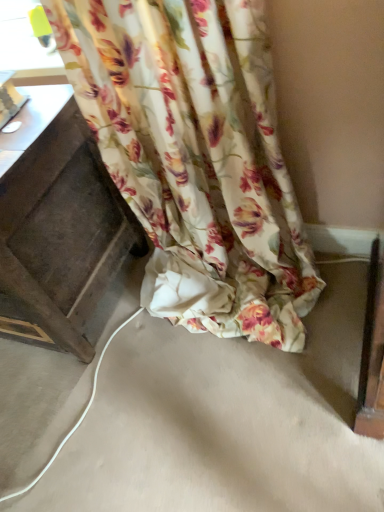
Find the location of a particular element. transparent plastic window at upper left is located at coordinates (26, 47).

The width and height of the screenshot is (384, 512). I want to click on transparent plastic window at upper left, so click(26, 47).

Does transparent plastic window at upper left appear on the left side of floral fabric curtain at lower center?

Correct, you'll find transparent plastic window at upper left to the left of floral fabric curtain at lower center.

From the image's perspective, between transparent plastic window at upper left and floral fabric curtain at lower center, who is located below?

From the image's view, floral fabric curtain at lower center is below.

Is transparent plastic window at upper left directly adjacent to floral fabric curtain at lower center?

transparent plastic window at upper left is not next to floral fabric curtain at lower center, and they're not touching.

Can you see transparent plastic window at upper left touching dark wood drawer at left?

No, transparent plastic window at upper left is not in contact with dark wood drawer at left.

Can you tell me how much transparent plastic window at upper left and dark wood drawer at left differ in facing direction?

The facing directions of transparent plastic window at upper left and dark wood drawer at left are 15.3 degrees apart.

From a real-world perspective, between transparent plastic window at upper left and dark wood drawer at left, who is vertically lower?

In real-world perspective, dark wood drawer at left is lower.

Considering the sizes of objects transparent plastic window at upper left and dark wood drawer at left in the image provided, who is smaller, transparent plastic window at upper left or dark wood drawer at left?

transparent plastic window at upper left.

Could you tell me if floral fabric curtain at lower center is turned towards transparent plastic window at upper left?

No, floral fabric curtain at lower center is not aimed at transparent plastic window at upper left.

Could you measure the distance between floral fabric curtain at lower center and transparent plastic window at upper left?

floral fabric curtain at lower center and transparent plastic window at upper left are 21.53 inches apart.

Between point (145, 187) and point (39, 61), which one is positioned behind?

Positioned behind is point (39, 61).

From a real-world perspective, is floral fabric curtain at lower center above or below transparent plastic window at upper left?

From a real-world perspective, floral fabric curtain at lower center is physically below transparent plastic window at upper left.

Which is nearer, (56, 301) or (163, 206)?

The point (56, 301) is closer.

Considering the relative sizes of dark wood drawer at left and floral fabric curtain at lower center in the image provided, is dark wood drawer at left smaller than floral fabric curtain at lower center?

No, dark wood drawer at left is not smaller than floral fabric curtain at lower center.

Considering the positions of objects dark wood drawer at left and floral fabric curtain at lower center in the image provided, who is more to the left, dark wood drawer at left or floral fabric curtain at lower center?

Positioned to the left is dark wood drawer at left.

Looking at this image, considering the sizes of objects floral fabric curtain at lower center and dark wood drawer at left in the image provided, who is wider, floral fabric curtain at lower center or dark wood drawer at left?

dark wood drawer at left is wider.

Is the surface of floral fabric curtain at lower center in direct contact with dark wood drawer at left?

No, floral fabric curtain at lower center is not making contact with dark wood drawer at left.

In the scene shown: Who is shorter, floral fabric curtain at lower center or dark wood drawer at left?

dark wood drawer at left.

Which object is closer to the camera, dark wood drawer at left or transparent plastic window at upper left?

dark wood drawer at left is in front.

From the image's perspective, is dark wood drawer at left above or below transparent plastic window at upper left?

From the image's perspective, dark wood drawer at left appears below transparent plastic window at upper left.

From a real-world perspective, does dark wood drawer at left stand above transparent plastic window at upper left?

No, from a real-world perspective, dark wood drawer at left is not above transparent plastic window at upper left.

In the image, there is a transparent plastic window at upper left. Where is `curtain below it (from a real-world perspective)`? curtain below it (from a real-world perspective) is located at coordinates (196, 158).

Identify the location of furniture located in front of the transparent plastic window at upper left. The width and height of the screenshot is (384, 512). (61, 230).

Considering their positions, is dark wood drawer at left positioned further to floral fabric curtain at lower center than transparent plastic window at upper left?

Among the two, transparent plastic window at upper left is located further to floral fabric curtain at lower center.

Considering their positions, is floral fabric curtain at lower center positioned closer to transparent plastic window at upper left than dark wood drawer at left?

Based on the image, dark wood drawer at left appears to be nearer to transparent plastic window at upper left.

Considering their positions, is floral fabric curtain at lower center positioned closer to dark wood drawer at left than transparent plastic window at upper left?

Answer: Among the two, floral fabric curtain at lower center is located nearer to dark wood drawer at left.

Considering their positions, is transparent plastic window at upper left positioned further to dark wood drawer at left than floral fabric curtain at lower center?

transparent plastic window at upper left is further to dark wood drawer at left.

Considering their positions, is dark wood drawer at left positioned closer to transparent plastic window at upper left than floral fabric curtain at lower center?

dark wood drawer at left.

Based on their spatial positions, is transparent plastic window at upper left or dark wood drawer at left closer to floral fabric curtain at lower center?

dark wood drawer at left.

You are a GUI agent. You are given a task and a screenshot of the screen. Output one action in this format:
    pyautogui.click(x=<x>, y=<y>)
    Task: Click on the window between dark wood drawer at left and floral fabric curtain at lower center in the horizontal direction
    The image size is (384, 512).
    Given the screenshot: What is the action you would take?
    pyautogui.click(x=26, y=47)